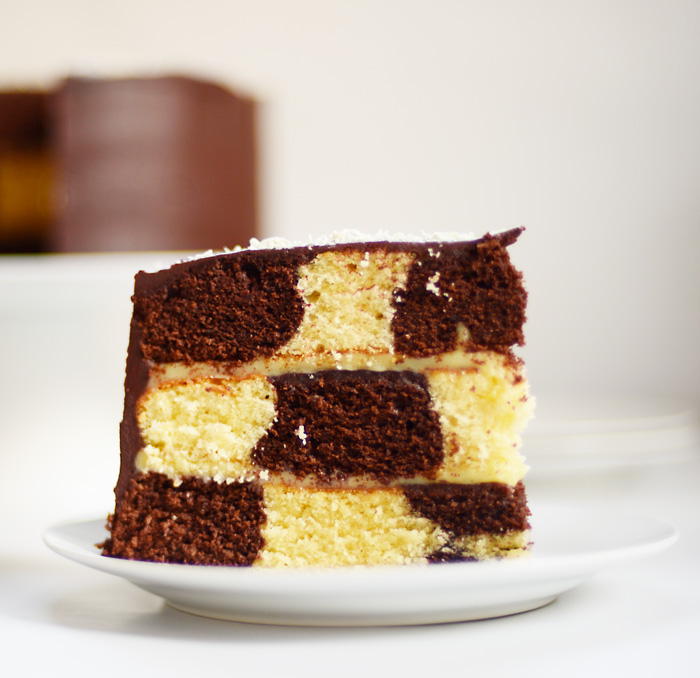
I want to click on edge of plate far right, so click(x=680, y=530).